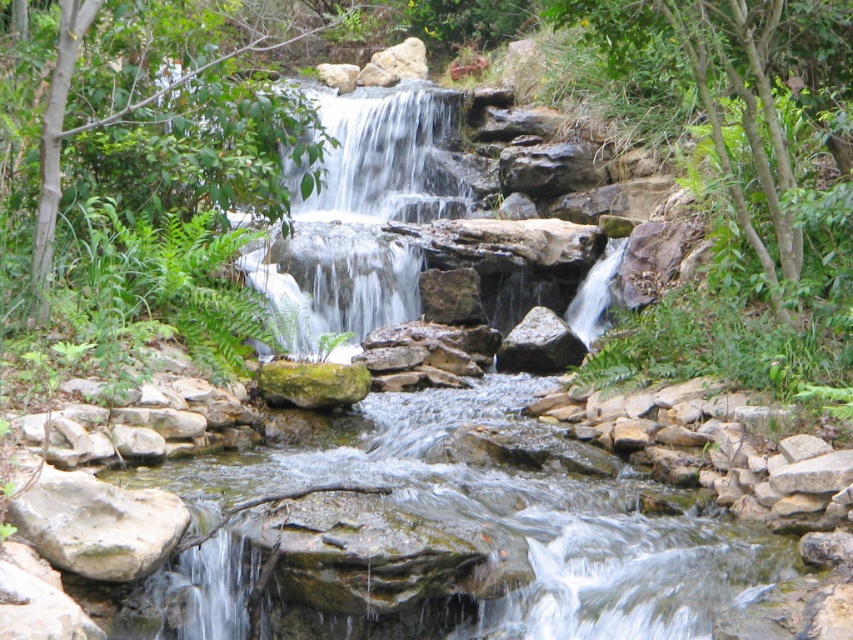
Can you confirm if gray rough rock at lower left is positioned to the right of gray rough rock at center?

In fact, gray rough rock at lower left is to the left of gray rough rock at center.

Is gray rough rock at lower left smaller than gray rough rock at center?

Correct, gray rough rock at lower left occupies less space than gray rough rock at center.

Identify the location of gray rough rock at lower left. (94, 522).

Locate an element on the screen. green mossy rock at center is located at coordinates (517, 518).

Which is behind, point (509, 512) or point (103, 506)?

Point (509, 512)

Who is more forward, (773, 566) or (44, 470)?

Positioned in front is point (44, 470).

Find the location of a particular element. The width and height of the screenshot is (853, 640). green mossy rock at center is located at coordinates (517, 518).

Does white textured water at center have a lesser width compared to gray rough rock at center?

Incorrect, white textured water at center's width is not less than gray rough rock at center's.

Consider the image. Is white textured water at center to the left of gray rough rock at center from the viewer's perspective?

Yes, white textured water at center is to the left of gray rough rock at center.

Who is more distant from viewer, (251, 269) or (560, 356)?

The point (251, 269) is more distant.

The width and height of the screenshot is (853, 640). Find the location of `white textured water at center`. white textured water at center is located at coordinates (361, 218).